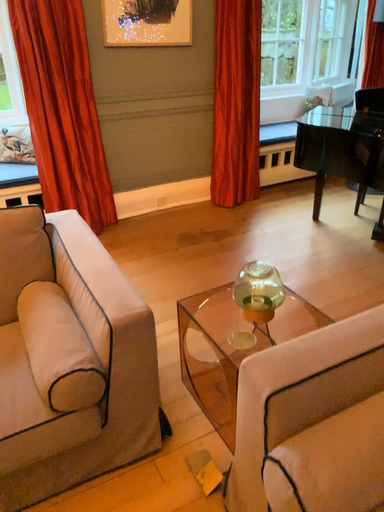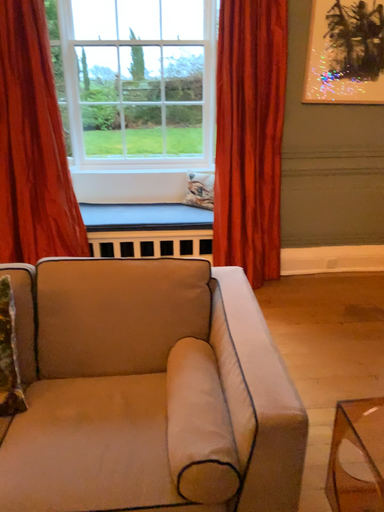
Question: How did the camera likely rotate when shooting the video?

Choices:
 (A) rotated downward
 (B) rotated upward

Answer: (B)